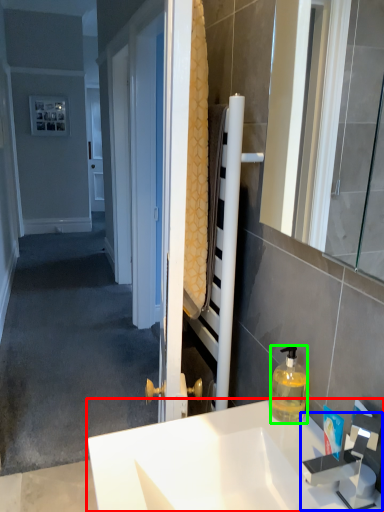
Question: Which object is the farthest from sink (highlighted by a red box)? Choose among these: faucet (highlighted by a blue box) or bottle (highlighted by a green box).

Choices:
 (A) faucet
 (B) bottle

Answer: (B)